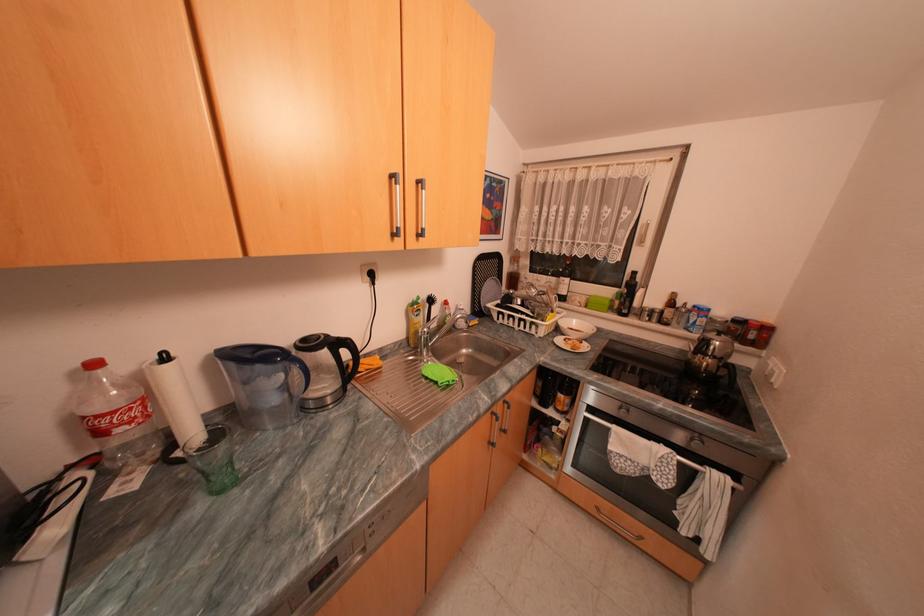
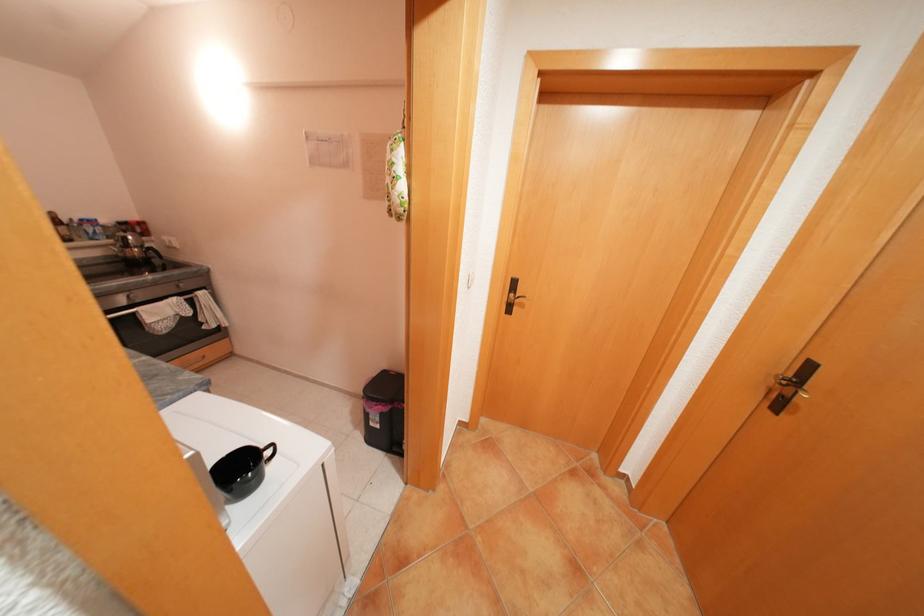
Where in the second image is the point corresponding to point (734, 371) from the first image?

(160, 253)